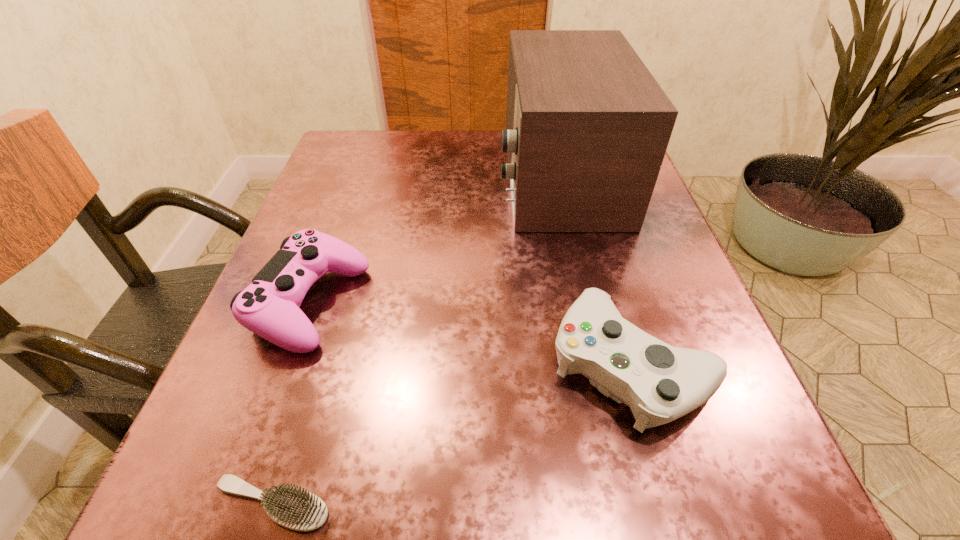
Find the location of a particular element. The image size is (960, 540). vacant space located 0.080m on the left of the right control is located at coordinates (493, 363).

Find the location of a particular element. vacant area situated on the back of the shortest object is located at coordinates (299, 421).

At what (x,y) coordinates should I click in order to perform the action: click on object that is at the far edge. Please return your answer as a coordinate pair (x, y). Looking at the image, I should click on (587, 125).

I want to click on object situated at the near edge, so click(297, 509).

I want to click on control present at the left edge, so click(x=269, y=307).

Locate an element on the screen. This screenshot has height=540, width=960. scrubbing brush that is at the left edge is located at coordinates (297, 509).

I want to click on radio receiver that is at the right edge, so click(x=587, y=125).

Where is `control that is at the right edge`? This screenshot has width=960, height=540. control that is at the right edge is located at coordinates (660, 383).

This screenshot has width=960, height=540. What are the coordinates of `object located in the near left corner section of the desktop` in the screenshot? It's located at (297, 509).

You are a GUI agent. You are given a task and a screenshot of the screen. Output one action in this format:
    pyautogui.click(x=<x>, y=<y>)
    Task: Click on the object that is positioned at the far right corner
    The width and height of the screenshot is (960, 540).
    Given the screenshot: What is the action you would take?
    pyautogui.click(x=587, y=125)